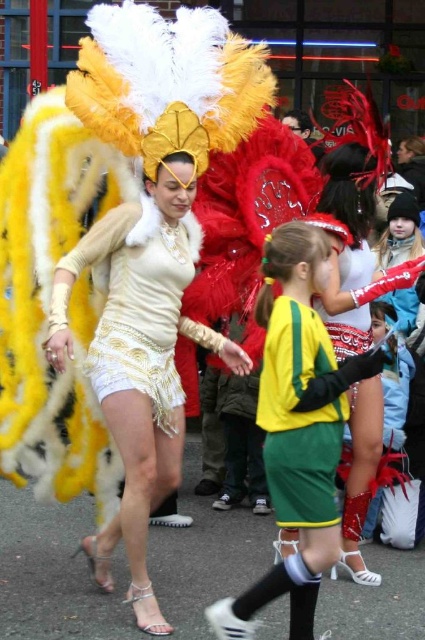
You are a photographer at the event and want to capture both the matte gold dress at center and the green jersey at center in a single frame. Since you can adjust your camera angle, which object should you focus on first to ensure both are in the shot?

The matte gold dress at center is taller than the green jersey at center. To ensure both are in the shot, focus on the matte gold dress at center first as it is taller and will occupy more space in the frame.

You are standing at the point marked by the coordinates point (59, 356). You want to give a gift to the woman in the gold dress with the feathered headdress. Can you reach her from your current position without moving closer than 4 meters?

The distance between you and the woman in the gold dress with the feathered headdress is 4.78 meters. Since 4.78 meters is greater than 4 meters, you cannot reach her without moving closer.